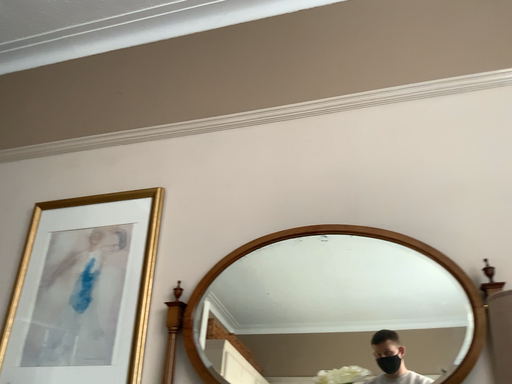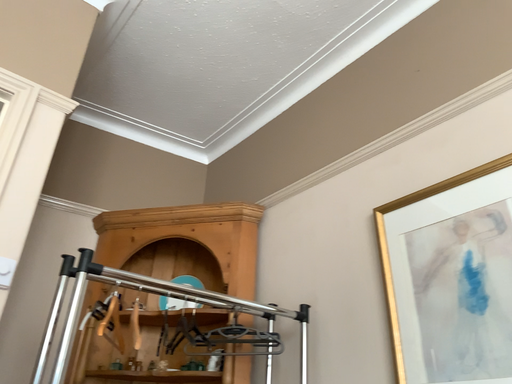
Question: How did the camera likely rotate when shooting the video?

Choices:
 (A) rotated right
 (B) rotated left

Answer: (B)